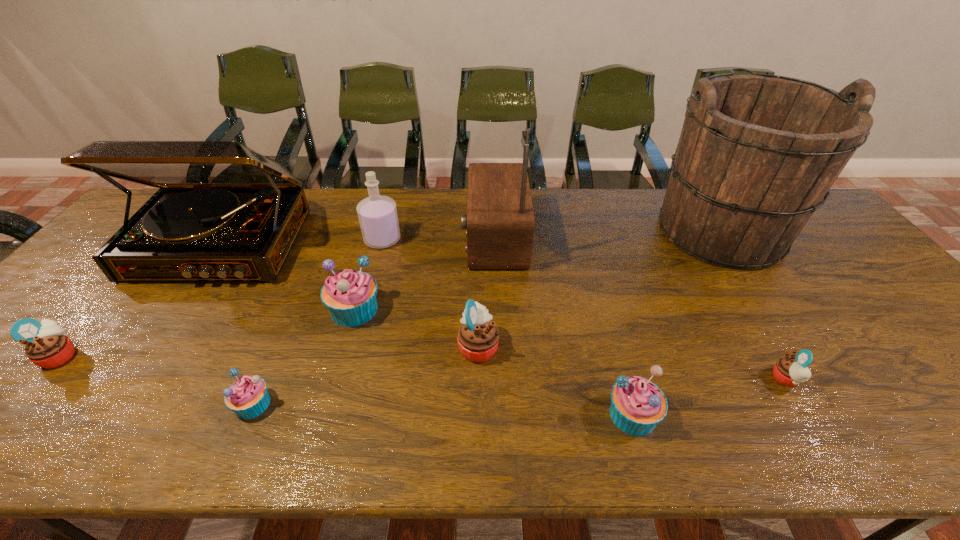
This screenshot has width=960, height=540. What are the coordinates of `free region at the far edge of the desktop` in the screenshot? It's located at (620, 197).

This screenshot has height=540, width=960. In the image, there is a desktop. In order to click on blank space at the near edge in this screenshot , I will do `click(884, 431)`.

The width and height of the screenshot is (960, 540). I want to click on vacant space at the left edge of the desktop, so click(x=7, y=395).

Find the location of a particular element. vacant space at the right edge of the desktop is located at coordinates (831, 239).

You are a GUI agent. You are given a task and a screenshot of the screen. Output one action in this format:
    pyautogui.click(x=<x>, y=<y>)
    Task: Click on the vacant space that is in between the radio receiver and the second muffin from left to right
    Image resolution: width=960 pixels, height=540 pixels.
    Given the screenshot: What is the action you would take?
    pyautogui.click(x=373, y=321)

Locate an element on the screen. The width and height of the screenshot is (960, 540). blank region between the smallest blue muffin and the radio receiver is located at coordinates (373, 321).

Where is `free spot between the rightmost blue muffin and the radio receiver`? The image size is (960, 540). free spot between the rightmost blue muffin and the radio receiver is located at coordinates (564, 326).

This screenshot has height=540, width=960. Find the location of `free space between the radio receiver and the eighth object from left to right`. free space between the radio receiver and the eighth object from left to right is located at coordinates (564, 326).

Find the location of a particular element. This screenshot has height=540, width=960. free space between the smallest pink muffin and the second blue muffin from right to left is located at coordinates (570, 344).

I want to click on free space between the second muffin from left to right and the rightmost pink muffin, so click(519, 392).